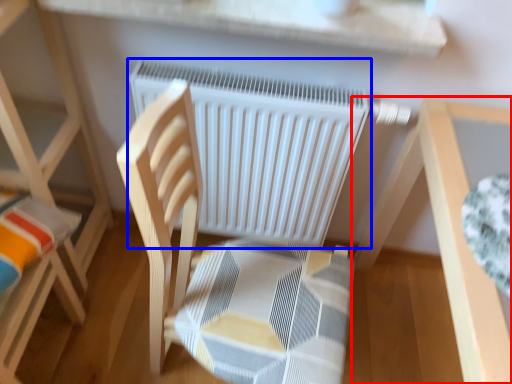
Question: Which object appears closest to the camera in this image, table (highlighted by a red box) or radiator (highlighted by a blue box)?

Choices:
 (A) table
 (B) radiator

Answer: (A)